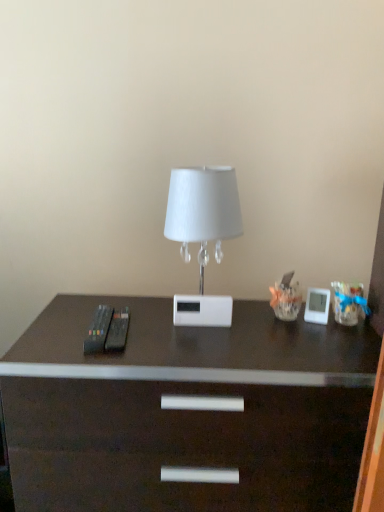
The height and width of the screenshot is (512, 384). Describe the element at coordinates (203, 234) in the screenshot. I see `white glossy lamp at center` at that location.

From the picture: Measure the distance between point (215,309) and camera.

Point (215,309) is 3.70 feet away from camera.

Locate an element on the screen. This screenshot has height=512, width=384. white glossy lamp at center is located at coordinates (203, 234).

Measure the distance between white glossy lamp at center and camera.

The distance of white glossy lamp at center from camera is 3.37 feet.

Describe the element at coordinates (186, 412) in the screenshot. The height and width of the screenshot is (512, 384). I see `dark wood desk at center` at that location.

You are a GUI agent. You are given a task and a screenshot of the screen. Output one action in this format:
    pyautogui.click(x=<x>, y=<y>)
    Task: Click on the dark wood desk at center
    
    Given the screenshot: What is the action you would take?
    pyautogui.click(x=186, y=412)

Locate an element on the screen. The width and height of the screenshot is (384, 512). white glossy lamp at center is located at coordinates (203, 234).

Based on their positions, is dark wood desk at center located to the left or right of white glossy lamp at center?

From the image, it's evident that dark wood desk at center is to the left of white glossy lamp at center.

In the scene shown: Does dark wood desk at center come in front of white glossy lamp at center?

Yes, dark wood desk at center is in front of white glossy lamp at center.

Is point (182, 478) closer to viewer compared to point (220, 313)?

Yes, point (182, 478) is closer to viewer.

From the image's perspective, which one is positioned lower, dark wood desk at center or white glossy lamp at center?

dark wood desk at center.

From a real-world perspective, is dark wood desk at center located beneath white glossy lamp at center?

Yes, from a real-world perspective, dark wood desk at center is below white glossy lamp at center.

Between dark wood desk at center and white glossy lamp at center, which one has smaller width?

Thinner between the two is white glossy lamp at center.

Is dark wood desk at center taller than white glossy lamp at center?

Correct, dark wood desk at center is much taller as white glossy lamp at center.

Can you confirm if dark wood desk at center is bigger than white glossy lamp at center?

Correct, dark wood desk at center is larger in size than white glossy lamp at center.

Is white glossy lamp at center completely or partially inside dark wood desk at center?

Actually, white glossy lamp at center is outside dark wood desk at center.

Would you consider dark wood desk at center to be distant from white glossy lamp at center?

dark wood desk at center is near white glossy lamp at center, not far away.

Is dark wood desk at center oriented away from white glossy lamp at center?

No, dark wood desk at center is not facing the opposite direction of white glossy lamp at center.

Can you tell me how much dark wood desk at center and white glossy lamp at center differ in facing direction?

They differ by 0.599 degrees in their facing directions.

Where is `desk below the white glossy lamp at center (from a real-world perspective)`? desk below the white glossy lamp at center (from a real-world perspective) is located at coordinates (186, 412).

Is white glossy lamp at center at the left side of dark wood desk at center?

No.

Which object is further away from the camera, white glossy lamp at center or dark wood desk at center?

white glossy lamp at center.

Which is less distant, [237,198] or [32,373]?

Point [237,198] appears to be farther away from the viewer than point [32,373].

From the image's perspective, does white glossy lamp at center appear lower than dark wood desk at center?

Incorrect, from the image's perspective, white glossy lamp at center is higher than dark wood desk at center.

From a real-world perspective, is white glossy lamp at center positioned under dark wood desk at center based on gravity?

Actually, white glossy lamp at center is physically above dark wood desk at center in the real world.

Does white glossy lamp at center have a greater width compared to dark wood desk at center?

In fact, white glossy lamp at center might be narrower than dark wood desk at center.

Considering the sizes of objects white glossy lamp at center and dark wood desk at center in the image provided, who is shorter, white glossy lamp at center or dark wood desk at center?

With less height is white glossy lamp at center.

Is white glossy lamp at center smaller than dark wood desk at center?

Yes.

Based on the photo, is white glossy lamp at center surrounding dark wood desk at center?

No.

Is white glossy lamp at center touching dark wood desk at center?

No, white glossy lamp at center is not beside dark wood desk at center.

Is white glossy lamp at center oriented away from dark wood desk at center?

No, dark wood desk at center is not at the back of white glossy lamp at center.

Can you tell me how much white glossy lamp at center and dark wood desk at center differ in facing direction?

white glossy lamp at center and dark wood desk at center are facing 0.599 degrees away from each other.

Locate an element on the screen. desk located underneath the white glossy lamp at center (from a real-world perspective) is located at coordinates (186, 412).

Image resolution: width=384 pixels, height=512 pixels. I want to click on lamp above the dark wood desk at center (from a real-world perspective), so click(x=203, y=234).

Where is `lamp that is above the dark wood desk at center (from the image's perspective)`? The height and width of the screenshot is (512, 384). lamp that is above the dark wood desk at center (from the image's perspective) is located at coordinates (203, 234).